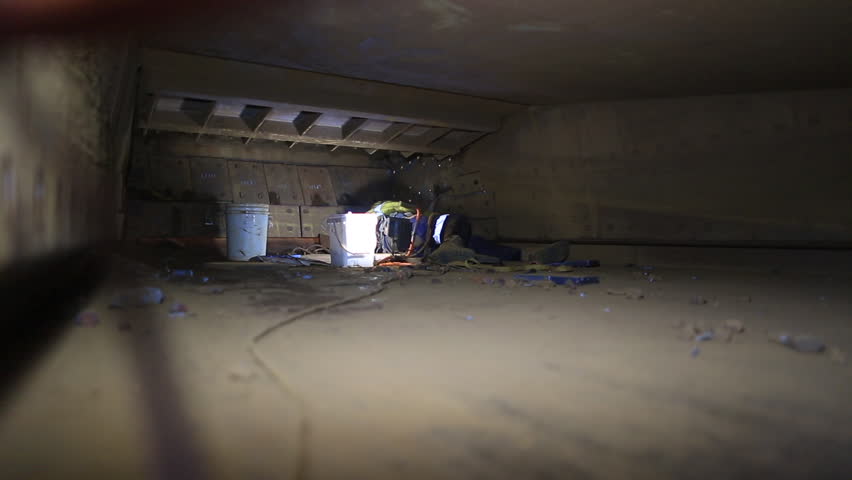
Locate an element on the screen. This screenshot has height=480, width=852. wooden support beams is located at coordinates (197, 113), (389, 113), (438, 129).